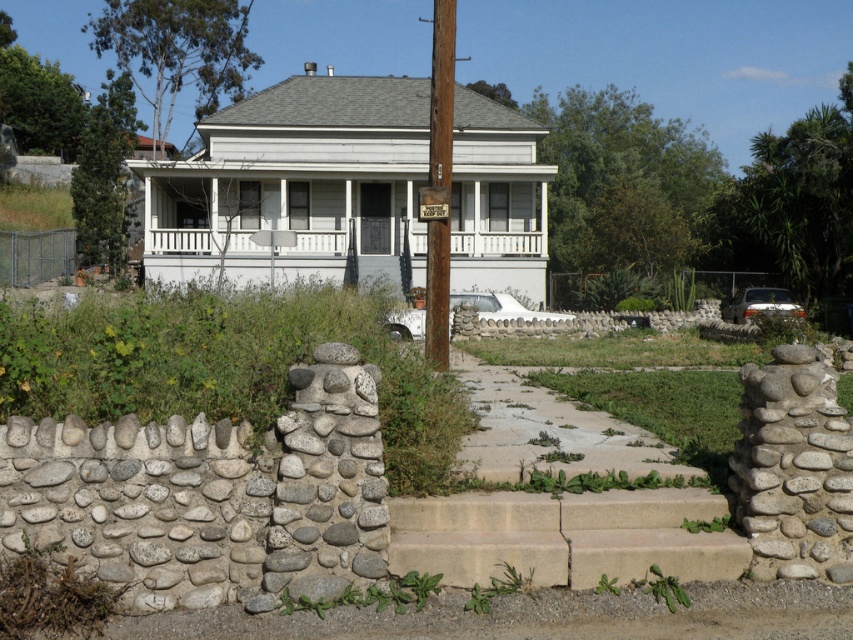
You are a delivery driver arriving at the house. You need to park the white matte truck at center so that it doesn not block the white painted wood porch at center. Given their sizes, is this possible?

The white painted wood porch at center is smaller than the white matte truck at center, so parking the truck without blocking the porch may be challenging due to the truck being larger. However, if positioned carefully away from the porch area, it might be possible.